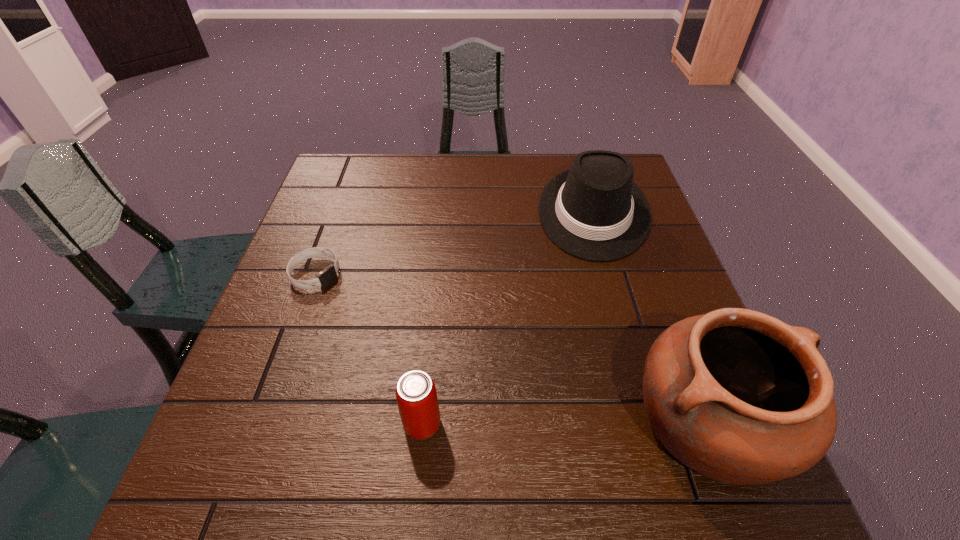
Where is `vacant spot on the desktop that is between the second object from left to right and the pottery and is positioned on the outer surface of the shortest object`? vacant spot on the desktop that is between the second object from left to right and the pottery and is positioned on the outer surface of the shortest object is located at coordinates (565, 423).

Image resolution: width=960 pixels, height=540 pixels. What are the coordinates of `vacant space on the desktop that is between the beer can and the tallest object and is positioned on the front-facing side of the fedora` in the screenshot? It's located at (587, 423).